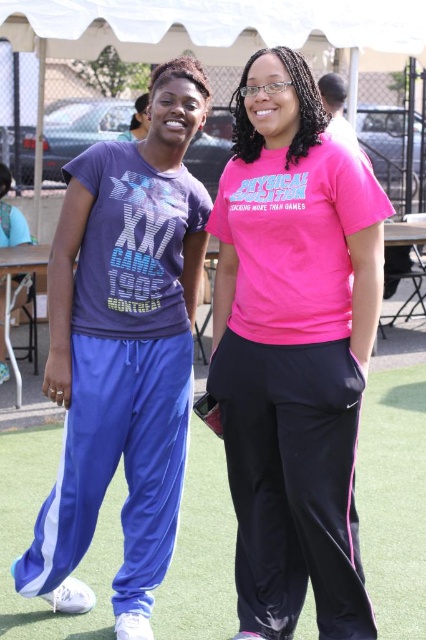
Question: From the image, what is the correct spatial relationship of pink matte t-shirt at center in relation to blue track pants at lower center?

Choices:
 (A) below
 (B) above

Answer: (B)

Question: Is pink matte t-shirt at center below matte purple t-shirt at left?

Choices:
 (A) no
 (B) yes

Answer: (B)

Question: Which of the following is the farthest from the observer?

Choices:
 (A) blue track pants at lower center
 (B) pink matte t-shirt at center
 (C) matte purple t-shirt at left

Answer: (A)

Question: Is matte purple t-shirt at left bigger than blue track pants at lower center?

Choices:
 (A) yes
 (B) no

Answer: (B)

Question: Among these points, which one is farthest from the camera?

Choices:
 (A) (28, 488)
 (B) (273, 624)

Answer: (A)

Question: Which point is closer to the camera?

Choices:
 (A) matte purple t-shirt at left
 (B) blue track pants at lower center

Answer: (A)